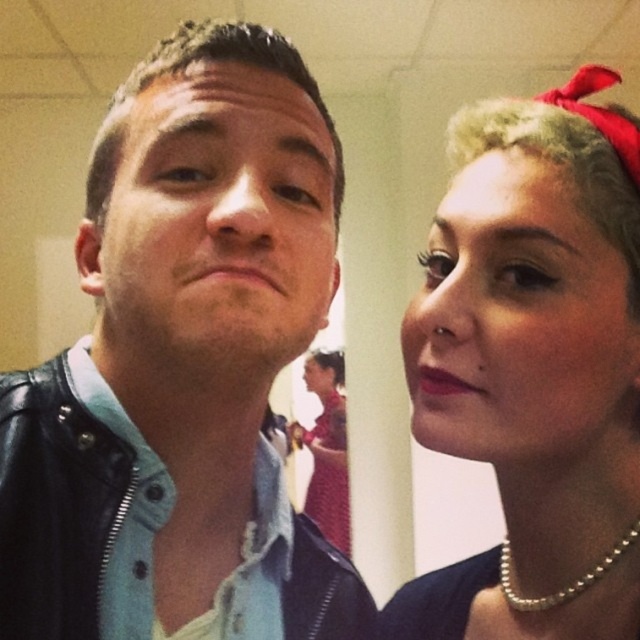
You are a tailor who needs to determine which jacket requires more fabric for alterations. Based on the image, which of the two jackets requires more fabric, the leather jacket at left or the matte black jacket at upper left?

The leather jacket at left requires more fabric because it is bigger than the matte black jacket at upper left.

You are taking a photo of two points in the image. The first point is at coordinate point (211, 104) and the second is at point (604, 268). If you want to focus on the point that is closer to you, which coordinate should you choose?

Point (211, 104) is closer to the camera than point (604, 268), so you should focus on point (211, 104).

You are a photographer trying to capture a closeup of the pearl necklace worn by the female individual. You notice a point at coordinates point (182,365). Is this point located on the leather jacket or the pearl necklace?

The point (182,365) is on the leather jacket at left, so it is not on the pearl necklace.